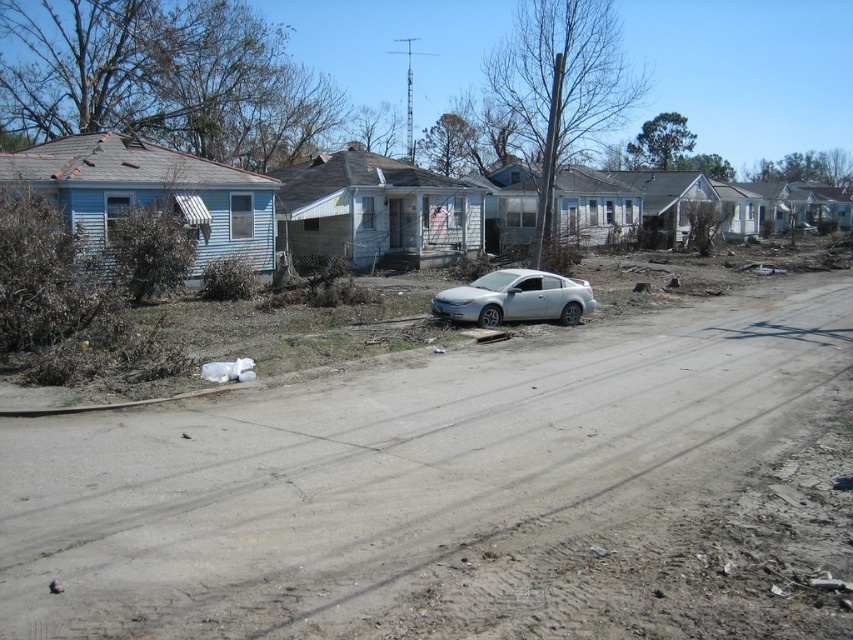
Is gray dirt track at center taller than silver metallic car at center?

No, gray dirt track at center is not taller than silver metallic car at center.

Who is taller, gray dirt track at center or silver metallic car at center?

Standing taller between the two is silver metallic car at center.

Does point (786, 410) lie behind point (540, 320)?

No, (786, 410) is closer to viewer.

Image resolution: width=853 pixels, height=640 pixels. In order to click on gray dirt track at center in this screenshot , I will do `click(405, 476)`.